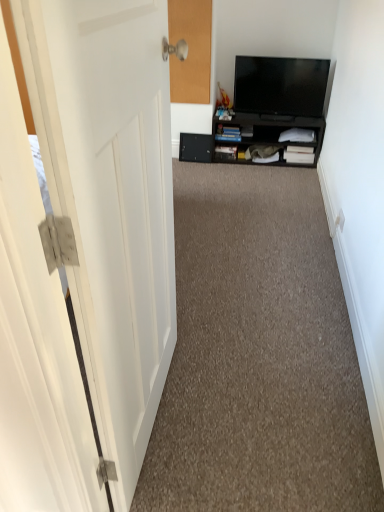
Question: Based on their positions, is black glossy tv at upper right located to the left or right of white matte door at left?

Choices:
 (A) left
 (B) right

Answer: (B)

Question: Considering the positions of black glossy tv at upper right and white matte door at left in the image, is black glossy tv at upper right wider or thinner than white matte door at left?

Choices:
 (A) thin
 (B) wide

Answer: (A)

Question: Considering the real-world distances, which object is farthest from the carpet at center?

Choices:
 (A) black matte cabinet at center
 (B) black matte drawer at center
 (C) black glossy tv at upper right
 (D) white matte door at left

Answer: (B)

Question: Which object is positioned farthest from the carpet at center?

Choices:
 (A) black matte drawer at center
 (B) black glossy tv at upper right
 (C) black matte cabinet at center
 (D) white matte door at left

Answer: (A)